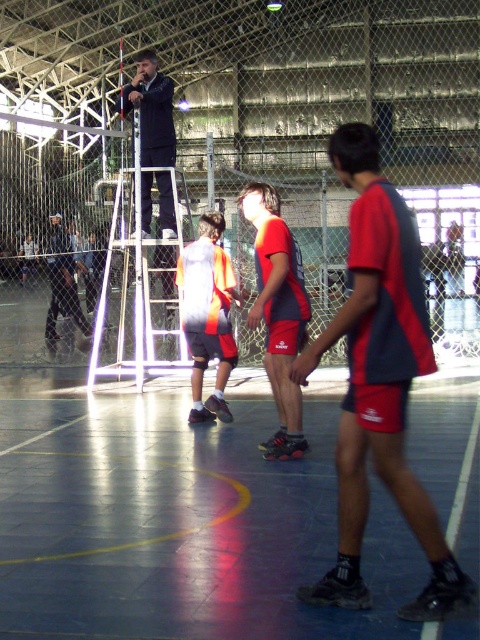
Question: Which point is closer to the camera?

Choices:
 (A) (191, 253)
 (B) (291, 337)
 (C) (416, 284)

Answer: (C)

Question: Which is nearer to the red fabric shorts at center?

Choices:
 (A) orange mesh shorts at center
 (B) matte red shorts at center
 (C) dark gray pants at left

Answer: (B)

Question: Can you confirm if red fabric shorts at center is positioned to the right of matte red shorts at center?

Choices:
 (A) yes
 (B) no

Answer: (A)

Question: Can you confirm if matte red shorts at center is positioned below dark gray pants at left?

Choices:
 (A) no
 (B) yes

Answer: (B)

Question: From the image, what is the correct spatial relationship of orange mesh shorts at center in relation to dark blue jacket at upper center?

Choices:
 (A) above
 (B) below

Answer: (B)

Question: Which point is closer to the camera?

Choices:
 (A) dark gray pants at left
 (B) red fabric shorts at center
 (C) dark blue jacket at upper center
 (D) matte red shorts at center

Answer: (B)